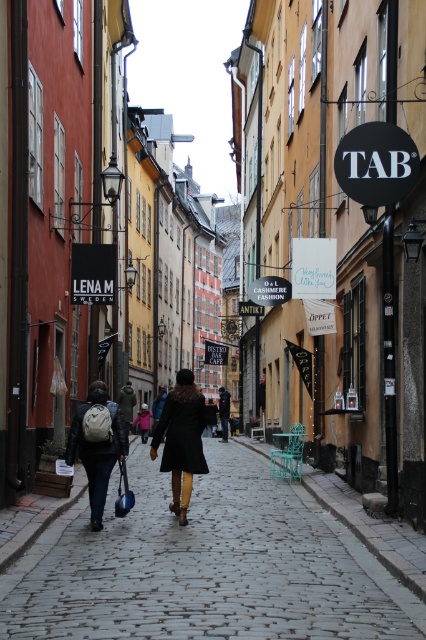
Question: Which point is closer to the camera?

Choices:
 (A) gray cobblestone pavement at center
 (B) matte black coat at center

Answer: (A)

Question: Which point is closer to the camera taking this photo?

Choices:
 (A) (88, 477)
 (B) (154, 442)
 (C) (276, 625)

Answer: (C)

Question: Does gray cobblestone pavement at center have a greater width compared to matte black backpack at center?

Choices:
 (A) yes
 (B) no

Answer: (A)

Question: Considering the real-world distances, which object is closest to the matte black coat at center?

Choices:
 (A) gray cobblestone pavement at center
 (B) matte black backpack at center

Answer: (B)

Question: Can you confirm if matte black coat at center is thinner than matte black backpack at center?

Choices:
 (A) no
 (B) yes

Answer: (B)

Question: From the image, what is the correct spatial relationship of gray cobblestone pavement at center in relation to matte black coat at center?

Choices:
 (A) left
 (B) right

Answer: (A)